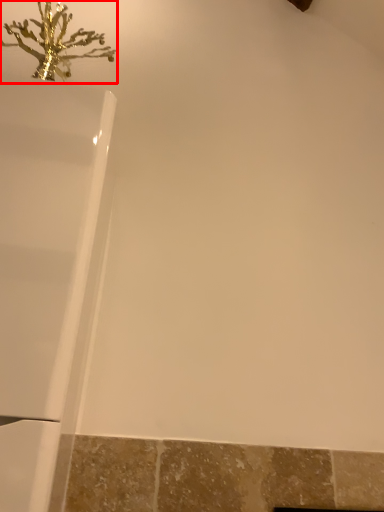
Question: From the image's perspective, where is christmas decoration (annotated by the red box) located relative to bathtub?

Choices:
 (A) below
 (B) above

Answer: (B)